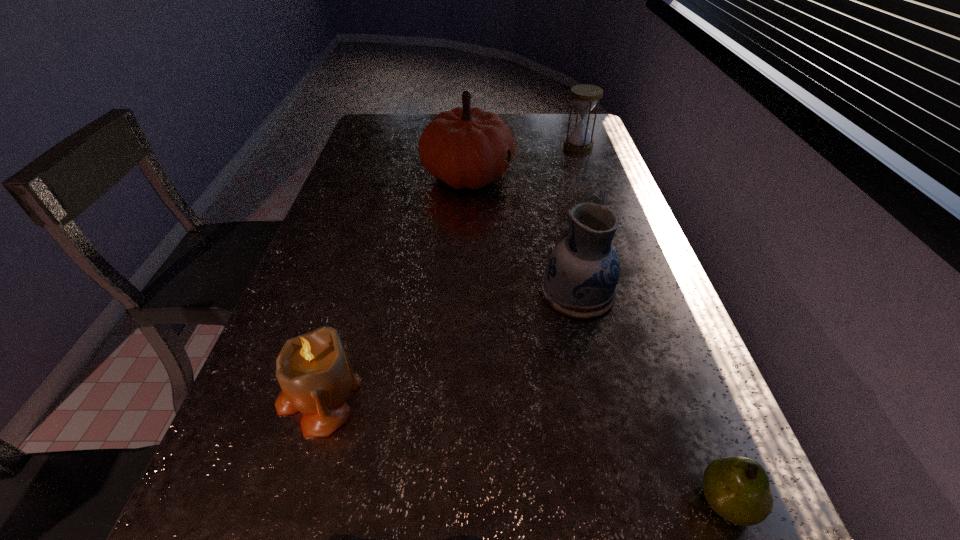
The image size is (960, 540). In order to click on free space located 0.060m on the left of the fourth tallest object in this screenshot , I will do `click(246, 395)`.

Locate an element on the screen. The image size is (960, 540). vacant area situated on the back of the fifth farthest object is located at coordinates tap(669, 355).

Where is `object located at the far edge`? object located at the far edge is located at coordinates (585, 96).

Locate an element on the screen. The height and width of the screenshot is (540, 960). object that is at the left edge is located at coordinates (313, 370).

Locate an element on the screen. pottery that is at the right edge is located at coordinates (582, 272).

The height and width of the screenshot is (540, 960). Identify the location of hourglass present at the right edge. (585, 96).

The height and width of the screenshot is (540, 960). I want to click on pear present at the right edge, so click(737, 488).

Where is `object located at the far right corner`? The height and width of the screenshot is (540, 960). object located at the far right corner is located at coordinates (585, 96).

Locate an element on the screen. This screenshot has width=960, height=540. vacant space at the far edge is located at coordinates (522, 119).

At what (x,y) coordinates should I click in order to perform the action: click on vacant space at the left edge. Please return your answer as a coordinate pair (x, y). The image size is (960, 540). Looking at the image, I should click on (330, 204).